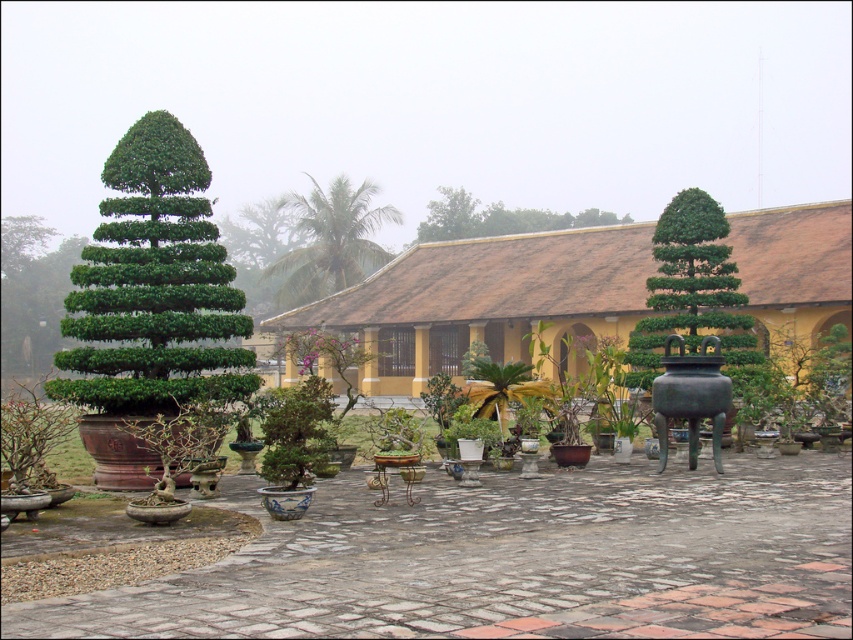
You are standing in the courtyard and want to water the green leafy palm at center. Your watering can has a range of 50 meters. Can you reach it with your current watering can?

The green leafy palm at center is 56.26 meters away from viewer, which is beyond the watering can range of 50 meters. You cannot reach it with your current watering can.

You are standing in the courtyard and want to place a small statue exactly at the center of the courtyard. The green leafy palm at center is currently occupying that spot. Can you move it to the right by 0.1 units in the 2D plane to make space?

The green leafy palm at center is located at point (329, 240). Moving it 0.1 units to the right would place it at (329, 304), which should free up the center area for the statue.

You are a gardener planning to water the green glossy bonsai at right and the green leafy palm at center. Since you have a limited amount of water, you want to prioritize watering the plant that is closer to you. Based on the scene, which plant should you water first?

The green glossy bonsai at right is located below the green leafy palm at center, which means it is closer to you. Therefore, you should prioritize watering the green glossy bonsai at right first.